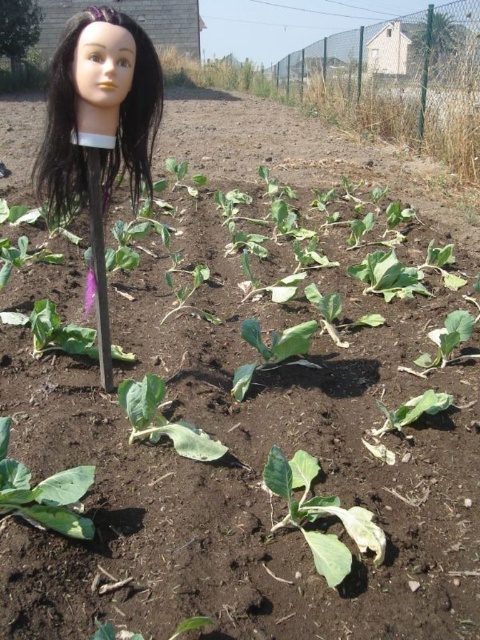
Question: Is black synthetic hair at center bigger than green matte leafy vegetable at center?

Choices:
 (A) yes
 (B) no

Answer: (A)

Question: Is the position of green matte leafy vegetable at center more distant than that of green leafy vegetable at center?

Choices:
 (A) yes
 (B) no

Answer: (B)

Question: Which object is farther from the camera taking this photo?

Choices:
 (A) green leafy vegetable at lower left
 (B) green leafy vegetable at center

Answer: (B)

Question: Which object is positioned farthest from the green leafy vegetable at lower left?

Choices:
 (A) green matte leafy vegetable at center
 (B) black synthetic hair at center

Answer: (B)

Question: Which of the following is the farthest from the observer?

Choices:
 (A) black synthetic hair at center
 (B) green leafy vegetable at lower left
 (C) green leafy vegetable at center
 (D) green matte leafy vegetable at center

Answer: (A)

Question: Can you confirm if green matte leafy vegetable at center is thinner than green leafy vegetable at center?

Choices:
 (A) no
 (B) yes

Answer: (B)